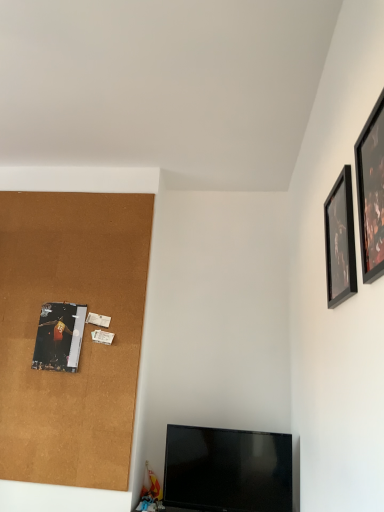
Question: Are black glossy picture frame at upper right, the first picture frame in the front-to-back sequence, and black glossy tv at lower center far apart?

Choices:
 (A) no
 (B) yes

Answer: (B)

Question: From a real-world perspective, is black glossy picture frame at upper right, the first picture frame in the front-to-back sequence, physically above black glossy tv at lower center?

Choices:
 (A) yes
 (B) no

Answer: (A)

Question: Is the position of black glossy picture frame at upper right, which ranks as the third picture frame in back-to-front order, more distant than that of black glossy tv at lower center?

Choices:
 (A) no
 (B) yes

Answer: (A)

Question: Is black glossy picture frame at upper right, which is the 2th picture frame from right to left, oriented towards black glossy tv at lower center?

Choices:
 (A) no
 (B) yes

Answer: (A)

Question: Is black glossy picture frame at upper right, which ranks as the 2th picture frame in left-to-right order, not within black glossy tv at lower center?

Choices:
 (A) no
 (B) yes

Answer: (B)

Question: Can you confirm if black glossy picture frame at upper right, which ranks as the 2th picture frame in left-to-right order, is wider than black glossy tv at lower center?

Choices:
 (A) no
 (B) yes

Answer: (A)

Question: Does black glossy tv at lower center have a greater width compared to metallic silver poster at left, the 1th picture frame when ordered from left to right?

Choices:
 (A) no
 (B) yes

Answer: (B)

Question: Can we say black glossy tv at lower center lies outside metallic silver poster at left, the 1th picture frame when ordered from left to right?

Choices:
 (A) yes
 (B) no

Answer: (A)

Question: From a real-world perspective, is black glossy tv at lower center over metallic silver poster at left, which appears as the 3th picture frame when viewed from the right?

Choices:
 (A) yes
 (B) no

Answer: (B)

Question: Is black glossy tv at lower center facing towards metallic silver poster at left, the 1th picture frame when ordered from left to right?

Choices:
 (A) yes
 (B) no

Answer: (B)

Question: From the image's perspective, would you say black glossy tv at lower center is positioned over metallic silver poster at left, which appears as the 3th picture frame when viewed from the right?

Choices:
 (A) no
 (B) yes

Answer: (A)

Question: Is black glossy tv at lower center closer to the viewer compared to metallic silver poster at left, the 1th picture frame when ordered from left to right?

Choices:
 (A) no
 (B) yes

Answer: (B)

Question: Is metallic silver poster at left, which appears as the 3th picture frame when viewed from the right, closer to the viewer compared to black matte picture frame at upper right, placed as the third picture frame when sorted from left to right?

Choices:
 (A) yes
 (B) no

Answer: (B)